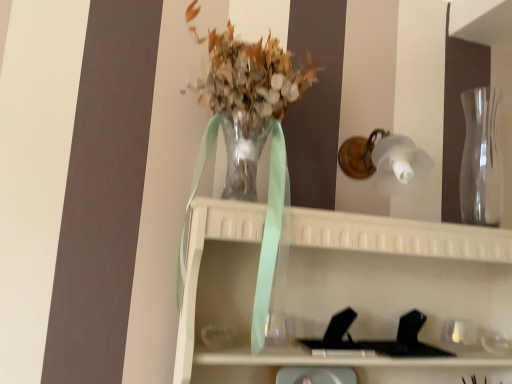
Question: In the image, is translucent glass vase at center positioned in front of or behind clear glass vase at right?

Choices:
 (A) behind
 (B) front

Answer: (B)

Question: Do you think translucent glass vase at center is within clear glass vase at right, or outside of it?

Choices:
 (A) outside
 (B) inside

Answer: (A)

Question: Is point (276, 134) positioned closer to the camera than point (497, 105)?

Choices:
 (A) closer
 (B) farther

Answer: (A)

Question: Considering the positions of clear glass vase at right and translucent glass vase at center in the image, is clear glass vase at right wider or thinner than translucent glass vase at center?

Choices:
 (A) wide
 (B) thin

Answer: (B)

Question: Based on their positions, is clear glass vase at right located to the left or right of translucent glass vase at center?

Choices:
 (A) left
 (B) right

Answer: (B)

Question: Do you think clear glass vase at right is within translucent glass vase at center, or outside of it?

Choices:
 (A) outside
 (B) inside

Answer: (A)

Question: Considering their positions, is clear glass vase at right located in front of or behind translucent glass vase at center?

Choices:
 (A) behind
 (B) front

Answer: (A)